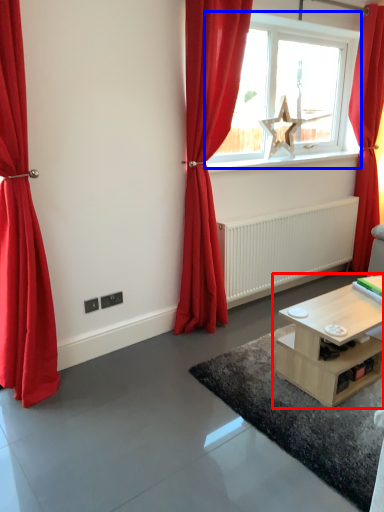
Question: Which of the following is the closest to the observer, table (highlighted by a red box) or window (highlighted by a blue box)?

Choices:
 (A) table
 (B) window

Answer: (A)